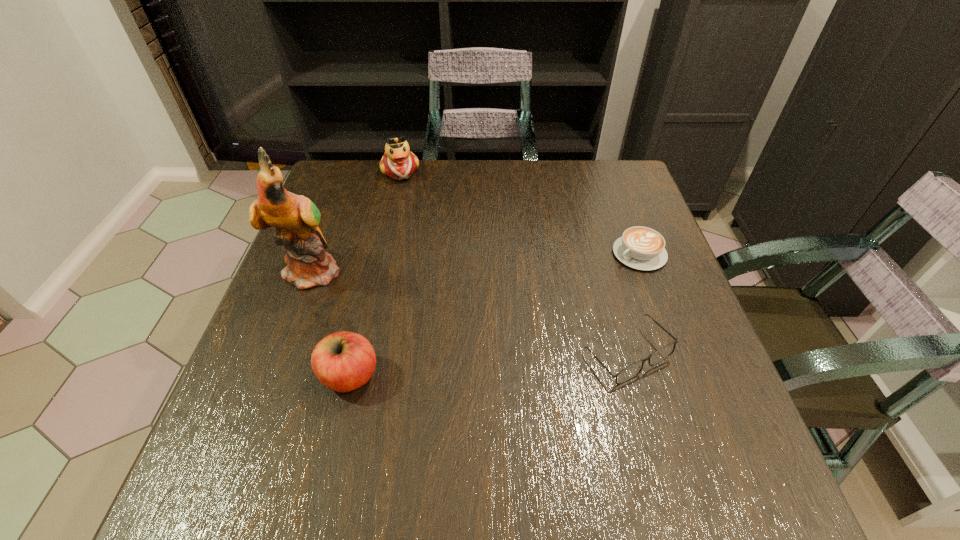
Identify the location of vacant space on the desktop that is between the third shortest object and the spectacles and is positioned on the face of the farthest object. The image size is (960, 540). (480, 366).

What are the coordinates of `free space on the desktop that is between the apple and the spectacles and is positioned on the side of the cappuccino with the handle` in the screenshot? It's located at (453, 368).

Where is `vacant space on the desktop that is between the apple and the spectacles and is positioned on the front-facing side of the tallest object`? This screenshot has width=960, height=540. vacant space on the desktop that is between the apple and the spectacles and is positioned on the front-facing side of the tallest object is located at coordinates (531, 361).